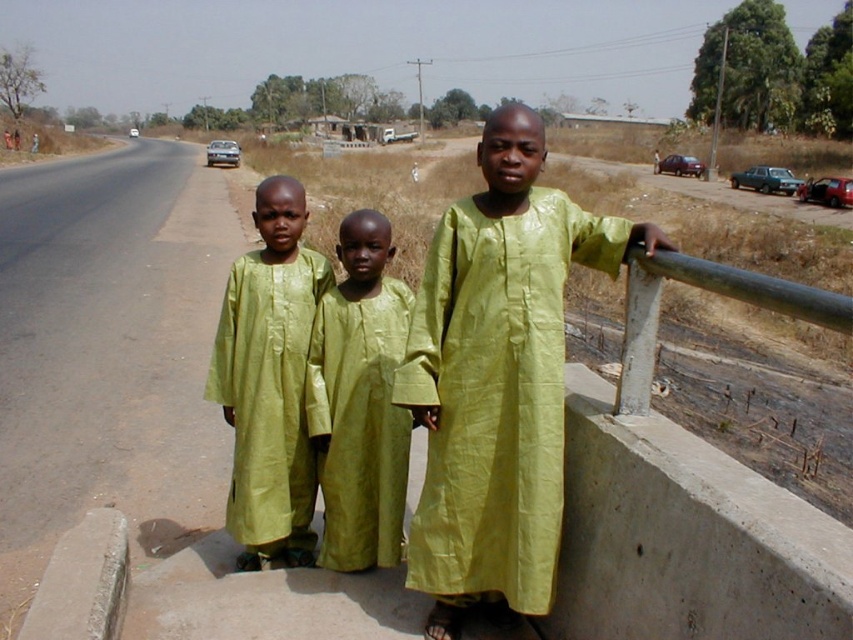
You are a photographer trying to capture a photo of the lime green silk robe at right and the green shiny dress at center. Which one should you focus on first if you want to ensure both are in focus?

The lime green silk robe at right is closer to the viewer than the green shiny dress at center. To ensure both are in focus, focus on the lime green silk robe at right first since it is closer, allowing the green shiny dress at center to be within the depth of field.

You are a photographer setting up a camera to capture the three children on the bridge. You notice the matte green dress at center and the green shiny dress at center. Which dress should you adjust your camera angle to focus on if you want to ensure the wider one is properly framed?

The matte green dress at center might be wider than green shiny dress at center, so you should focus on the matte green dress at center to ensure proper framing.